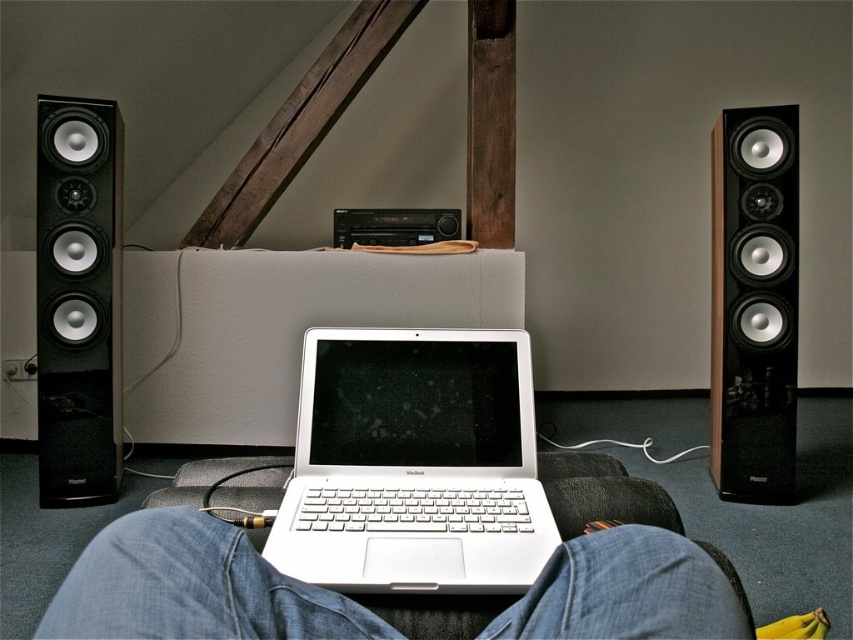
Question: Does white metallic laptop at center come in front of black glossy speaker at left?

Choices:
 (A) yes
 (B) no

Answer: (A)

Question: Considering the real-world distances, which object is closest to the jeans at center?

Choices:
 (A) black glossy speaker at left
 (B) black glossy speaker at right
 (C) white metallic laptop at center

Answer: (C)

Question: Can you confirm if white metallic laptop at center is positioned to the right of black glossy speaker at right?

Choices:
 (A) yes
 (B) no

Answer: (B)

Question: Which object is farther from the camera taking this photo?

Choices:
 (A) jeans at center
 (B) black glossy speaker at left
 (C) black glossy speaker at right
 (D) white metallic laptop at center

Answer: (C)

Question: Is jeans at center closer to camera compared to black glossy speaker at left?

Choices:
 (A) yes
 (B) no

Answer: (A)

Question: Among these objects, which one is nearest to the camera?

Choices:
 (A) black glossy speaker at right
 (B) black glossy speaker at left
 (C) jeans at center

Answer: (C)